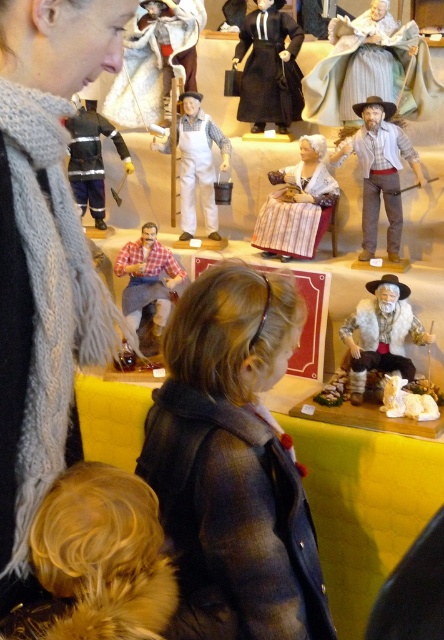
Is point (218, 554) positioned behind point (95, 131)?

No, it is in front of (95, 131).

Is point (301, 561) closer to viewer compared to point (95, 168)?

Yes.

Who is more forward, (202,342) or (70,116)?

Point (202,342) is in front.

Where is `flannel shirt at center`? This screenshot has width=444, height=640. flannel shirt at center is located at coordinates (233, 465).

Does white matte overalls at center have a larger size compared to checkered fabric figure at center?

Yes.

Is white matte overalls at center further to camera compared to checkered fabric figure at center?

Yes, it is behind checkered fabric figure at center.

Find the location of a particular element. The image size is (444, 640). white matte overalls at center is located at coordinates click(198, 164).

Image resolution: width=444 pixels, height=640 pixels. I want to click on white matte overalls at center, so click(198, 164).

Does point (178, 577) come closer to viewer compared to point (71, 538)?

No, (178, 577) is further to viewer.

At what (x,y) coordinates should I click in order to perform the action: click on flannel shirt at center. Please return your answer as a coordinate pair (x, y). This screenshot has width=444, height=640. Looking at the image, I should click on (233, 465).

In order to click on flannel shirt at center in this screenshot , I will do `click(233, 465)`.